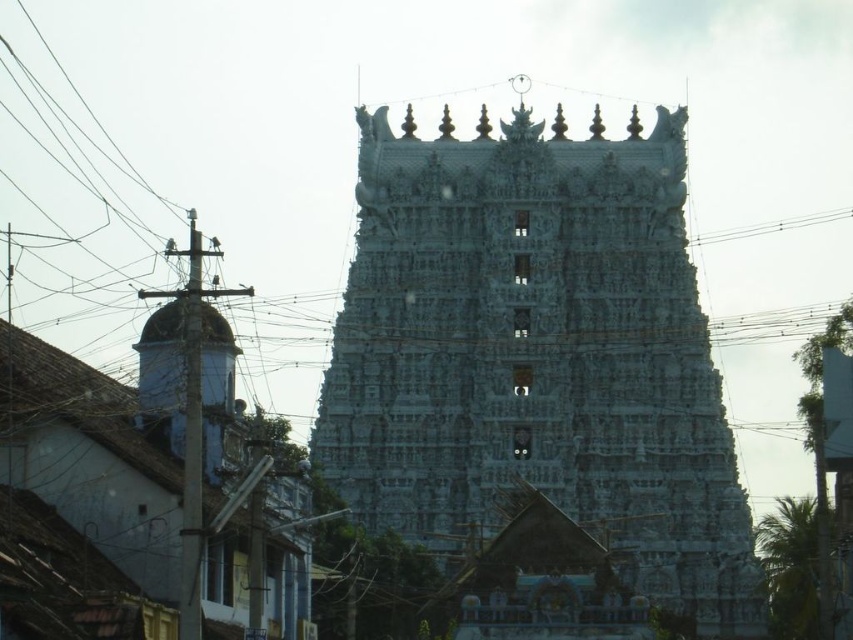
How far apart are white stone temple at center and black wire at upper center?

The distance of white stone temple at center from black wire at upper center is 64.76 feet.

Is white stone temple at center in front of black wire at upper center?

Yes, white stone temple at center is closer to the viewer.

Who is more forward, (532, 236) or (808, 225)?

Point (532, 236) is more forward.

The width and height of the screenshot is (853, 640). What are the coordinates of `white stone temple at center` in the screenshot? It's located at (537, 355).